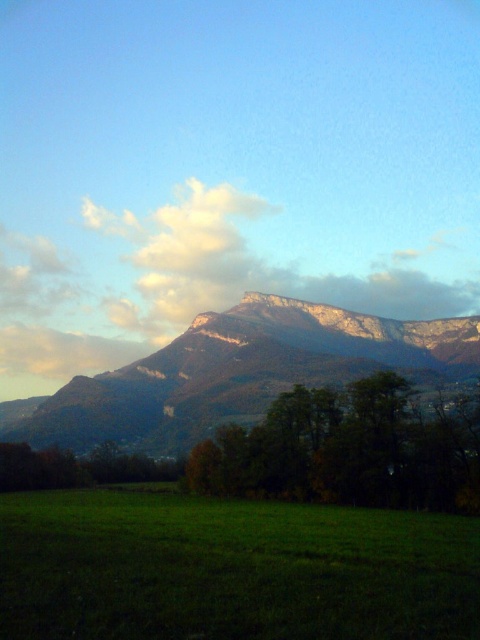
Question: Among these objects, which one is farthest from the camera?

Choices:
 (A) white fluffy cloud at upper center
 (B) green matte tree at center
 (C) rugged stone mountain range at center
 (D) green grass at lower left

Answer: (A)

Question: Does rugged stone mountain range at center have a greater width compared to white fluffy cloud at upper center?

Choices:
 (A) yes
 (B) no

Answer: (B)

Question: Considering the relative positions of rugged stone mountain range at center and green matte tree at center in the image provided, where is rugged stone mountain range at center located with respect to green matte tree at center?

Choices:
 (A) left
 (B) right

Answer: (B)

Question: Is green grass at lower left bigger than rugged stone mountain range at center?

Choices:
 (A) no
 (B) yes

Answer: (A)

Question: Which object appears closest to the camera in this image?

Choices:
 (A) green grass at lower left
 (B) rugged stone mountain range at center

Answer: (A)

Question: Estimate the real-world distances between objects in this image. Which object is farther from the green grass at lower left?

Choices:
 (A) green matte tree at center
 (B) rugged stone mountain range at center

Answer: (B)